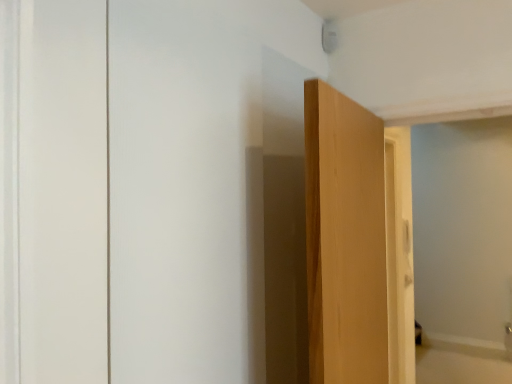
Question: Considering the positions of point (361, 289) and point (480, 377), is point (361, 289) closer or farther from the camera than point (480, 377)?

Choices:
 (A) closer
 (B) farther

Answer: (A)

Question: From the image's perspective, relative to beige wood bathtub at lower right, is light brown wood door at center above or below?

Choices:
 (A) below
 (B) above

Answer: (B)

Question: Considering the positions of light brown wood door at center and beige wood bathtub at lower right in the image, is light brown wood door at center bigger or smaller than beige wood bathtub at lower right?

Choices:
 (A) big
 (B) small

Answer: (A)

Question: Considering the positions of beige wood bathtub at lower right and light brown wood door at center in the image, is beige wood bathtub at lower right bigger or smaller than light brown wood door at center?

Choices:
 (A) big
 (B) small

Answer: (B)

Question: Considering the positions of beige wood bathtub at lower right and light brown wood door at center in the image, is beige wood bathtub at lower right wider or thinner than light brown wood door at center?

Choices:
 (A) thin
 (B) wide

Answer: (B)

Question: From the image's perspective, relative to light brown wood door at center, is beige wood bathtub at lower right above or below?

Choices:
 (A) below
 (B) above

Answer: (A)

Question: Is beige wood bathtub at lower right in front of or behind light brown wood door at center in the image?

Choices:
 (A) front
 (B) behind

Answer: (B)